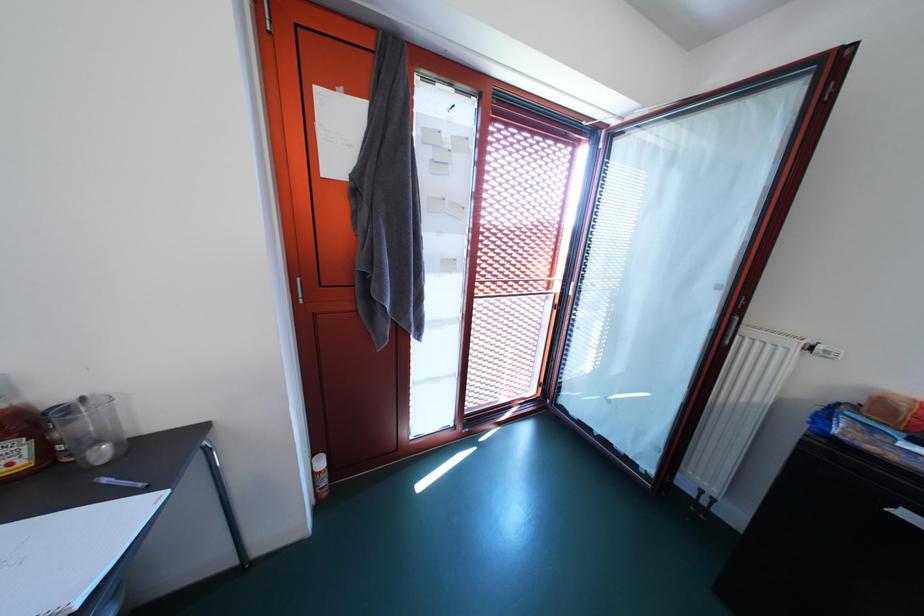
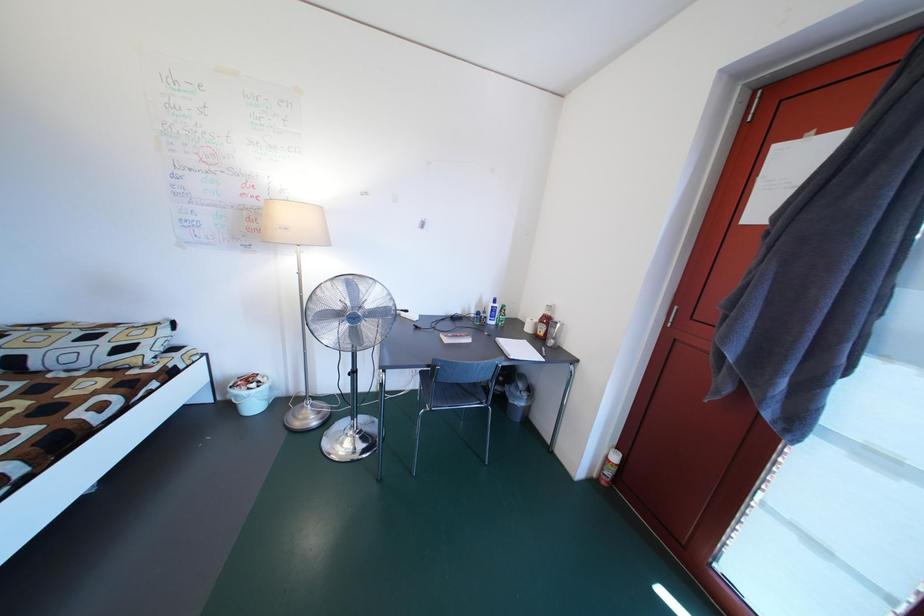
Question: The first image is from the beginning of the video and the second image is from the end. How did the camera likely rotate when shooting the video?

Choices:
 (A) Left
 (B) Right
 (C) Up
 (D) Down

Answer: (A)